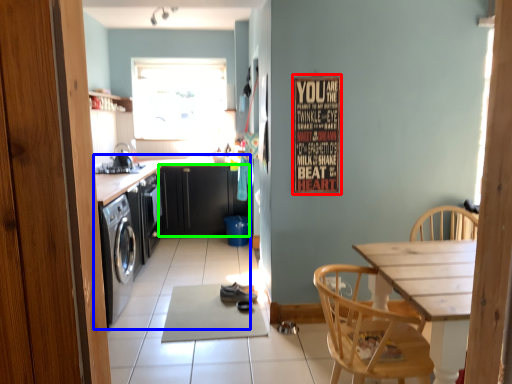
Question: Considering the real-world distances, which object is farthest from bulletin board (highlighted by a red box)? cabinetry (highlighted by a blue box) or cabinetry (highlighted by a green box)?

Choices:
 (A) cabinetry
 (B) cabinetry

Answer: (B)